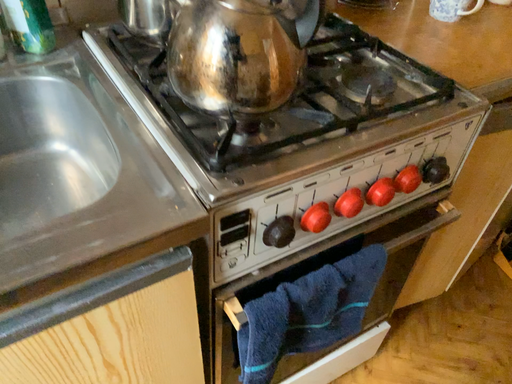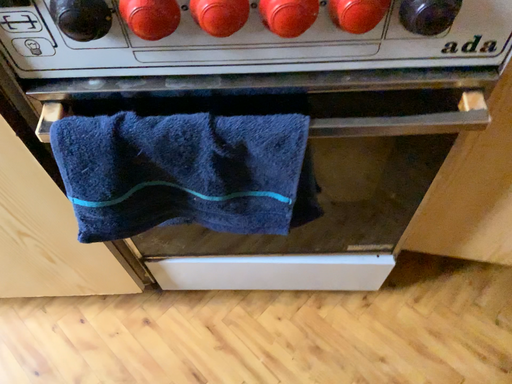
Question: Which way did the camera rotate in the video?

Choices:
 (A) rotated right
 (B) rotated left

Answer: (B)